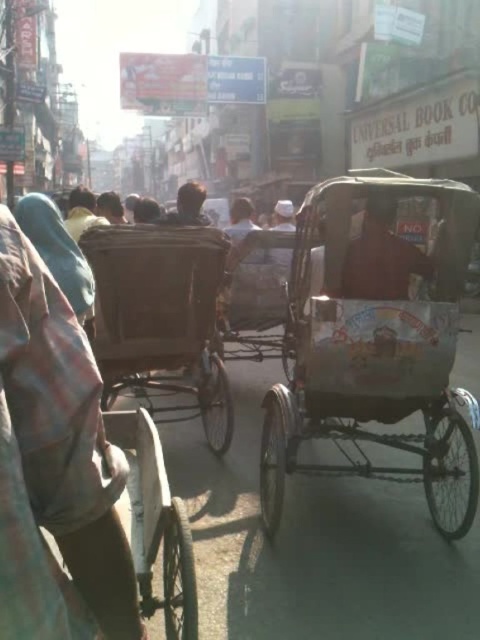
Question: In this image, where is white painted wood rickshaw at center located relative to wooden cart at center?

Choices:
 (A) below
 (B) above

Answer: (B)

Question: Can you confirm if white painted wood rickshaw at center is positioned below wooden cart at center?

Choices:
 (A) yes
 (B) no

Answer: (B)

Question: Among these objects, which one is nearest to the camera?

Choices:
 (A) wooden cart at center
 (B) white painted wood rickshaw at center

Answer: (B)

Question: Which object appears farthest from the camera in this image?

Choices:
 (A) white painted wood rickshaw at center
 (B) wooden cart at center

Answer: (B)

Question: Is white painted wood rickshaw at center wider than wooden cart at center?

Choices:
 (A) no
 (B) yes

Answer: (B)